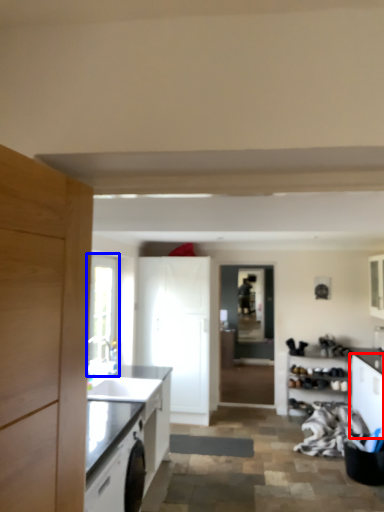
Question: Which object is closer to the camera taking this photo, cabinetry (highlighted by a red box) or window (highlighted by a blue box)?

Choices:
 (A) cabinetry
 (B) window

Answer: (A)